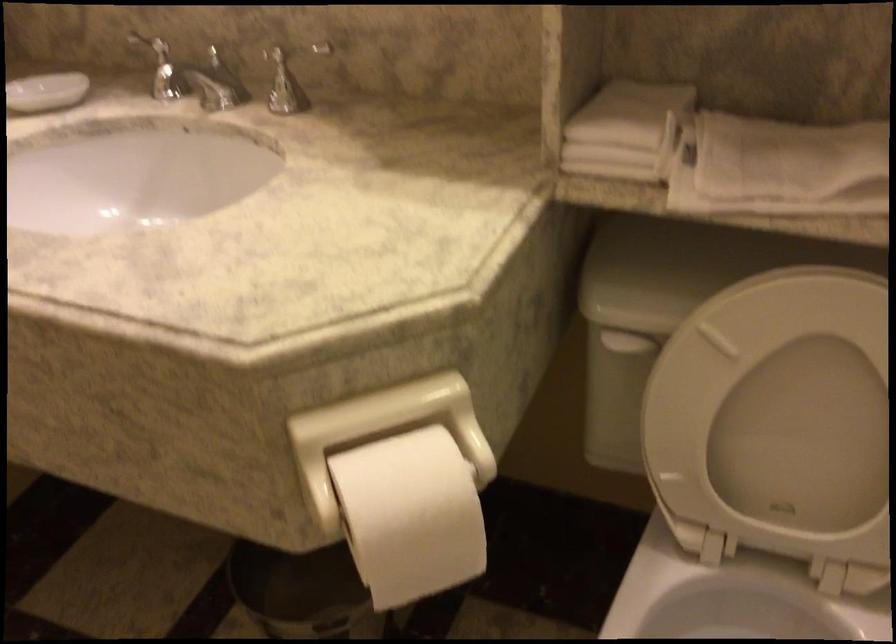
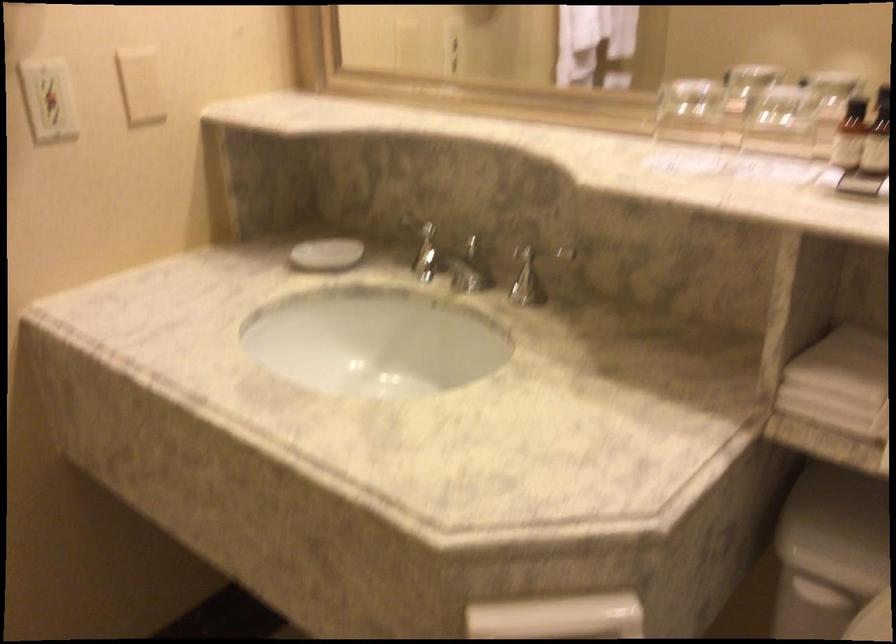
Question: The first image is from the beginning of the video and the second image is from the end. How did the camera likely rotate when shooting the video?

Choices:
 (A) Left
 (B) Right
 (C) Up
 (D) Down

Answer: (A)